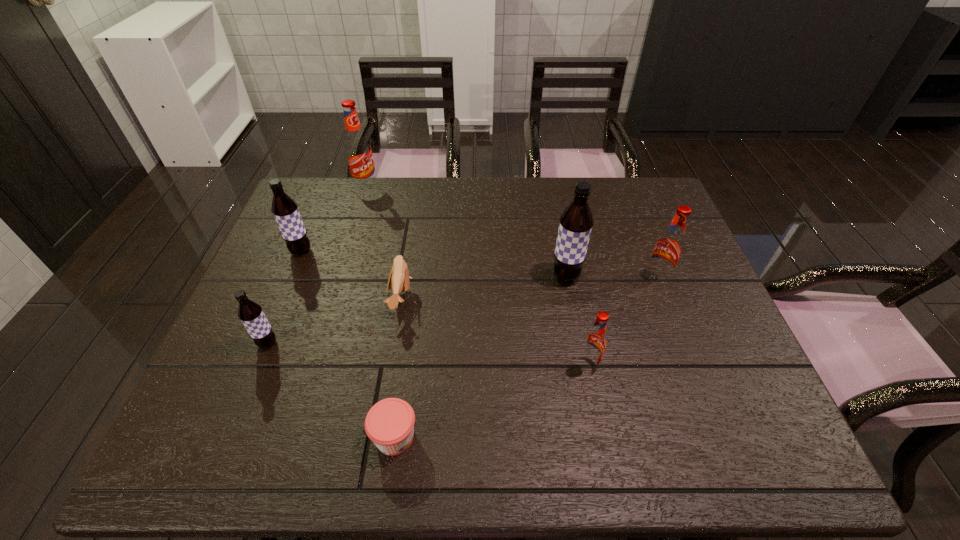
Find the location of `the fourth root beer from right to left`. the fourth root beer from right to left is located at coordinates (358, 151).

The image size is (960, 540). I want to click on the third object from left to right, so 358,151.

The height and width of the screenshot is (540, 960). Identify the location of the second farthest brown root beer. (576, 222).

Where is `the rightmost brown root beer`? The height and width of the screenshot is (540, 960). the rightmost brown root beer is located at coordinates (576, 222).

Where is `the rightmost root beer`? This screenshot has height=540, width=960. the rightmost root beer is located at coordinates (669, 247).

You are a GUI agent. You are given a task and a screenshot of the screen. Output one action in this format:
    pyautogui.click(x=<x>, y=<y>)
    Task: Click on the second nearest red root beer
    The height and width of the screenshot is (540, 960).
    Given the screenshot: What is the action you would take?
    pyautogui.click(x=669, y=247)

What are the coordinates of `the second farthest object` in the screenshot? It's located at (285, 210).

The width and height of the screenshot is (960, 540). Identify the location of the second farthest root beer. (285, 210).

What are the coordinates of `the smallest brown root beer` in the screenshot? It's located at (250, 313).

Image resolution: width=960 pixels, height=540 pixels. Identify the location of the fifth farthest root beer. (250, 313).